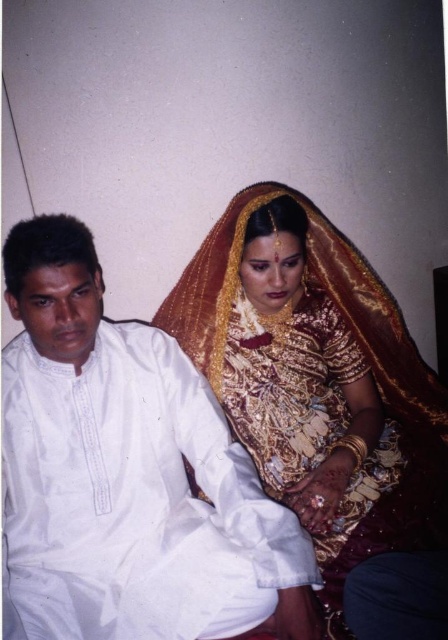
You are a photographer preparing to take a portrait of two people wearing traditional Indian attire. You have a camera with a lens that can focus on objects up to 3 meters away. The white cotton kurta at left is 1.2 meters away from the camera, and the gold embroidered saree at center is 2.5 meters away. Can both subjects be in focus simultaneously?

Both the white cotton kurta at left and the gold embroidered saree at center can be in focus simultaneously because the camera lens can focus up to 3 meters, and the saree is within that range at 2.5 meters. The kurta is even closer at 1.2 meters, so both distances are within the camera lens capability.

You are an interior designer observing the scene. You need to place a decorative shelf on the wall behind the two people. The shelf must be positioned above the gold embroidered saree at center but not overlapping the white cotton kurta at left. Is this placement possible?

The white cotton kurta at left is below the gold embroidered saree at center, so placing the shelf above the gold embroidered saree at center would not overlap the kurta since it is positioned lower. This placement is possible.